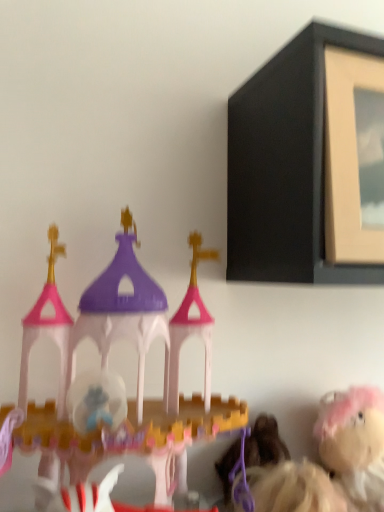
Consider the image. What is the approximate width of matte plastic castle at left, the 2th toy from the right?

9.18 inches.

This screenshot has width=384, height=512. What do you see at coordinates (354, 444) in the screenshot? I see `fluffy pink plush at lower right, the first toy viewed from the right` at bounding box center [354, 444].

You are a GUI agent. You are given a task and a screenshot of the screen. Output one action in this format:
    pyautogui.click(x=<x>, y=<y>)
    Task: Click on the fluffy pink plush at lower right, which is the 2th toy from front to back
    The width and height of the screenshot is (384, 512).
    Given the screenshot: What is the action you would take?
    pyautogui.click(x=354, y=444)

Identify the location of matte black picture frame at upper right. The height and width of the screenshot is (512, 384). (286, 166).

Image resolution: width=384 pixels, height=512 pixels. I want to click on matte plastic castle at left, which is the 1th toy from front to back, so click(104, 369).

Would you consider matte black picture frame at upper right to be distant from matte plastic castle at left, arranged as the 2th toy when viewed from the back?

No.

From a real-world perspective, which object rests below the other?

matte plastic castle at left, arranged as the 2th toy when viewed from the back.

Does point (265, 68) appear closer or farther from the camera than point (44, 459)?

Clearly, point (265, 68) is more distant from the camera than point (44, 459).

Would you say matte black picture frame at upper right is outside matte plastic castle at left, arranged as the 1th toy when viewed from the left?

Yes.

Is the depth of matte plastic castle at left, which is the 1th toy from front to back, greater than that of matte black picture frame at upper right?

No, it is in front of matte black picture frame at upper right.

Can you confirm if matte plastic castle at left, which is the 1th toy from front to back, is wider than matte black picture frame at upper right?

In fact, matte plastic castle at left, which is the 1th toy from front to back, might be narrower than matte black picture frame at upper right.

Would you say matte plastic castle at left, the 2th toy from the right, is inside or outside matte black picture frame at upper right?

matte plastic castle at left, the 2th toy from the right, is spatially situated outside matte black picture frame at upper right.

Based on the photo, from a real-world perspective, who is located lower, fluffy pink plush at lower right, which is the 2th toy in left-to-right order, or matte plastic castle at left, arranged as the 2th toy when viewed from the back?

From a 3D spatial view, fluffy pink plush at lower right, which is the 2th toy in left-to-right order, is below.

Considering the sizes of objects fluffy pink plush at lower right, the first toy viewed from the right, and matte plastic castle at left, which is the 1th toy from front to back, in the image provided, who is shorter, fluffy pink plush at lower right, the first toy viewed from the right, or matte plastic castle at left, which is the 1th toy from front to back,?

With less height is fluffy pink plush at lower right, the first toy viewed from the right.

Is fluffy pink plush at lower right, which is the 2th toy in left-to-right order, situated inside matte plastic castle at left, which is the 1th toy from front to back, or outside?

fluffy pink plush at lower right, which is the 2th toy in left-to-right order, is spatially situated outside matte plastic castle at left, which is the 1th toy from front to back.

Measure the distance from fluffy pink plush at lower right, the first toy viewed from the right, to matte plastic castle at left, the 2th toy from the right.

fluffy pink plush at lower right, the first toy viewed from the right, and matte plastic castle at left, the 2th toy from the right, are 16.05 inches apart.

Is matte plastic castle at left, arranged as the 2th toy when viewed from the back, thinner than fluffy pink plush at lower right, which is the 2th toy in left-to-right order?

In fact, matte plastic castle at left, arranged as the 2th toy when viewed from the back, might be wider than fluffy pink plush at lower right, which is the 2th toy in left-to-right order.

From a real-world perspective, relative to fluffy pink plush at lower right, which is the 2th toy in left-to-right order, is matte plastic castle at left, which is the 1th toy from front to back, vertically above or below?

In terms of real-world spatial position, matte plastic castle at left, which is the 1th toy from front to back, is above fluffy pink plush at lower right, which is the 2th toy in left-to-right order.

This screenshot has height=512, width=384. I want to click on toy located in front of the fluffy pink plush at lower right, the first toy viewed from the right, so click(104, 369).

How far apart are fluffy pink plush at lower right, the first toy viewed from the right, and matte black picture frame at upper right?

fluffy pink plush at lower right, the first toy viewed from the right, and matte black picture frame at upper right are 18.63 inches apart.

Can you confirm if fluffy pink plush at lower right, which is the 2th toy in left-to-right order, is bigger than matte black picture frame at upper right?

Incorrect, fluffy pink plush at lower right, which is the 2th toy in left-to-right order, is not larger than matte black picture frame at upper right.

Based on the photo, is fluffy pink plush at lower right, the first toy viewed from the right, facing towards matte black picture frame at upper right?

No, fluffy pink plush at lower right, the first toy viewed from the right, is not aimed at matte black picture frame at upper right.

Can you confirm if fluffy pink plush at lower right, which is the 2th toy in left-to-right order, is positioned to the right of matte black picture frame at upper right?

Yes, fluffy pink plush at lower right, which is the 2th toy in left-to-right order, is to the right of matte black picture frame at upper right.

Is matte black picture frame at upper right bigger than fluffy pink plush at lower right, the 1th toy positioned from the back?

Yes.

From a real-world perspective, is matte black picture frame at upper right below fluffy pink plush at lower right, which is the 2th toy in left-to-right order?

Actually, matte black picture frame at upper right is physically above fluffy pink plush at lower right, which is the 2th toy in left-to-right order, in the real world.

Relative to fluffy pink plush at lower right, which is the 2th toy in left-to-right order, is matte black picture frame at upper right in front or behind?

In the image, matte black picture frame at upper right appears in front of fluffy pink plush at lower right, which is the 2th toy in left-to-right order.

Is matte black picture frame at upper right outside of fluffy pink plush at lower right, the 1th toy positioned from the back?

Yes, matte black picture frame at upper right is located beyond the bounds of fluffy pink plush at lower right, the 1th toy positioned from the back.

Locate an element on the screen. This screenshot has width=384, height=512. toy in front of the matte black picture frame at upper right is located at coordinates (104, 369).

At what (x,y) coordinates should I click in order to perform the action: click on picture frame that is on the right side of matte plastic castle at left, arranged as the 1th toy when viewed from the left. Please return your answer as a coordinate pair (x, y). Looking at the image, I should click on (286, 166).

Which object lies further to the anchor point matte black picture frame at upper right, fluffy pink plush at lower right, the first toy viewed from the right, or matte plastic castle at left, arranged as the 2th toy when viewed from the back?

Based on the image, fluffy pink plush at lower right, the first toy viewed from the right, appears to be further to matte black picture frame at upper right.

Based on their spatial positions, is matte plastic castle at left, which is the 1th toy from front to back, or fluffy pink plush at lower right, the 1th toy positioned from the back, further from matte black picture frame at upper right?

fluffy pink plush at lower right, the 1th toy positioned from the back, lies further to matte black picture frame at upper right than the other object.

From the image, which object appears to be farther from fluffy pink plush at lower right, the 1th toy positioned from the back, matte plastic castle at left, arranged as the 1th toy when viewed from the left, or matte black picture frame at upper right?

Based on the image, matte black picture frame at upper right appears to be further to fluffy pink plush at lower right, the 1th toy positioned from the back.

From the image, which object appears to be farther from matte plastic castle at left, which is the 1th toy from front to back, matte black picture frame at upper right or fluffy pink plush at lower right, the 1th toy positioned from the back?

The object further to matte plastic castle at left, which is the 1th toy from front to back, is fluffy pink plush at lower right, the 1th toy positioned from the back.

When comparing their distances from matte plastic castle at left, arranged as the 2th toy when viewed from the back, does fluffy pink plush at lower right, which is the 2th toy in left-to-right order, or matte black picture frame at upper right seem closer?

matte black picture frame at upper right is closer to matte plastic castle at left, arranged as the 2th toy when viewed from the back.

Looking at the image, which one is located further to fluffy pink plush at lower right, the first toy viewed from the right, matte black picture frame at upper right or matte plastic castle at left, arranged as the 2th toy when viewed from the back?

The object further to fluffy pink plush at lower right, the first toy viewed from the right, is matte black picture frame at upper right.

Find the location of a particular element. This screenshot has width=384, height=512. toy between matte black picture frame at upper right and fluffy pink plush at lower right, the first toy viewed from the right, in the up-down direction is located at coordinates (104, 369).